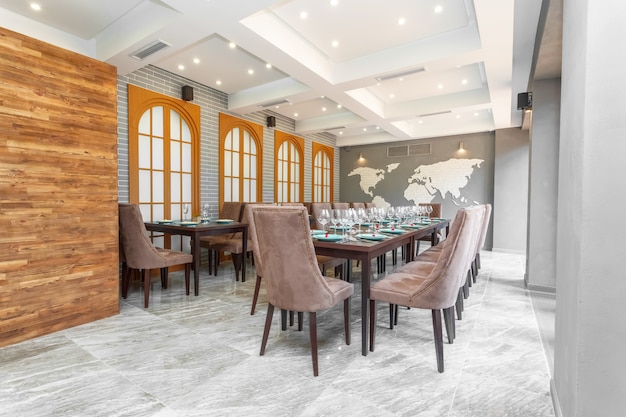
Image resolution: width=626 pixels, height=417 pixels. Find the location of `dining seats`. dining seats is located at coordinates (148, 247), (285, 272), (417, 276), (421, 266), (434, 252), (483, 220).